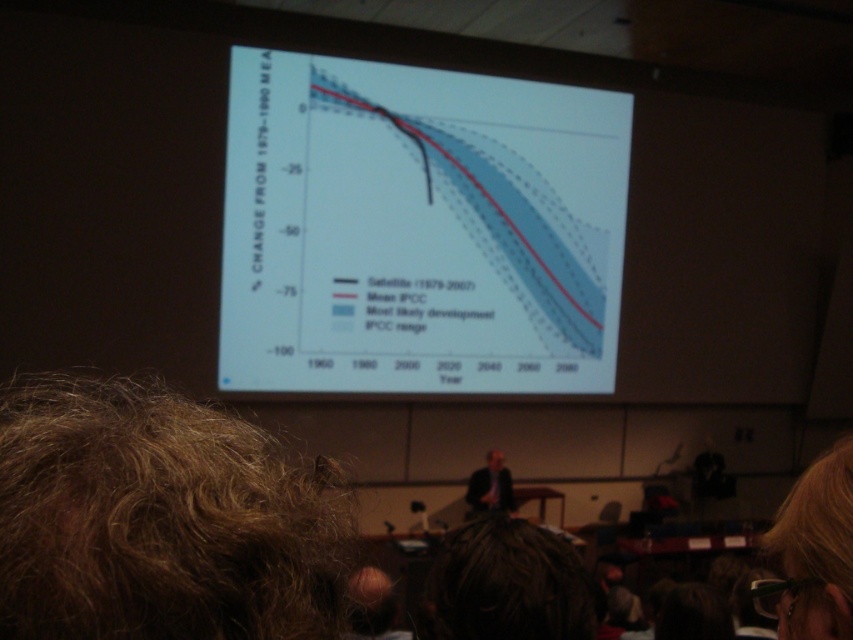
Question: From the image, what is the correct spatial relationship of white paper at center in relation to brown curly hair at lower left?

Choices:
 (A) above
 (B) below

Answer: (A)

Question: Does white paper at center have a larger size compared to dark brown hair at center?

Choices:
 (A) yes
 (B) no

Answer: (A)

Question: Which of these objects is positioned farthest from the dark brown hair at center?

Choices:
 (A) white paper at center
 (B) dark suit at center

Answer: (A)

Question: Among these objects, which one is nearest to the camera?

Choices:
 (A) brown curly hair at lower left
 (B) white paper at center
 (C) dark brown hair at center

Answer: (C)

Question: Does white paper at center have a greater width compared to brown curly hair at lower left?

Choices:
 (A) yes
 (B) no

Answer: (A)

Question: Which object is the closest to the dark brown hair at center?

Choices:
 (A) white paper at center
 (B) brown curly hair at lower left

Answer: (B)